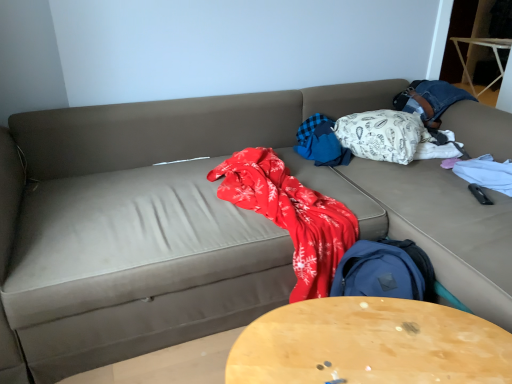
The image size is (512, 384). Identify the location of free spot above wooden round table at center (from a real-world perspective). (372, 342).